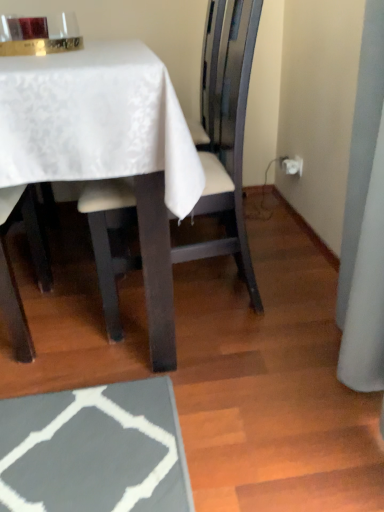
Find the location of a particular element. The height and width of the screenshot is (512, 384). vacant area to the right of white leather chair at center is located at coordinates (291, 291).